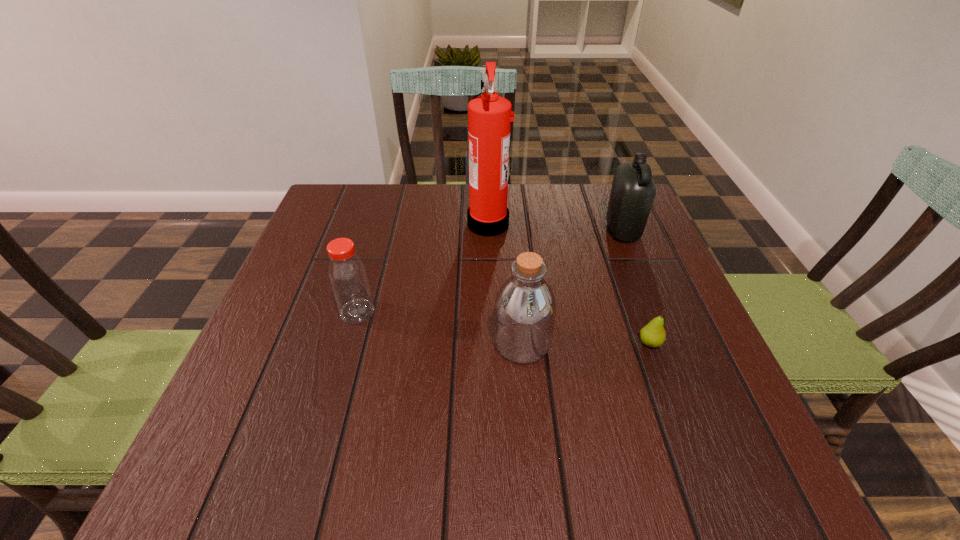
Locate an element on the screen. The width and height of the screenshot is (960, 540). the tallest object is located at coordinates (489, 116).

Image resolution: width=960 pixels, height=540 pixels. Find the location of `the rightmost bottle`. the rightmost bottle is located at coordinates (633, 191).

Where is `the second bottle from left to right`? the second bottle from left to right is located at coordinates (525, 307).

Image resolution: width=960 pixels, height=540 pixels. Find the location of `the second shortest object`. the second shortest object is located at coordinates (347, 274).

Locate an element on the screen. Image resolution: width=960 pixels, height=540 pixels. the shortest bottle is located at coordinates (347, 274).

Locate an element on the screen. This screenshot has height=540, width=960. the shortest object is located at coordinates (653, 335).

The width and height of the screenshot is (960, 540). I want to click on free space located with the nozzle aimed from the fire extinguisher, so click(316, 223).

The image size is (960, 540). Identify the location of free location located with the nozzle aimed from the fire extinguisher. tap(407, 223).

This screenshot has width=960, height=540. Identify the location of free region located with the nozzle aimed from the fire extinguisher. (372, 223).

Image resolution: width=960 pixels, height=540 pixels. I want to click on vacant position located 0.220m on the left of the rightmost bottle, so click(x=519, y=231).